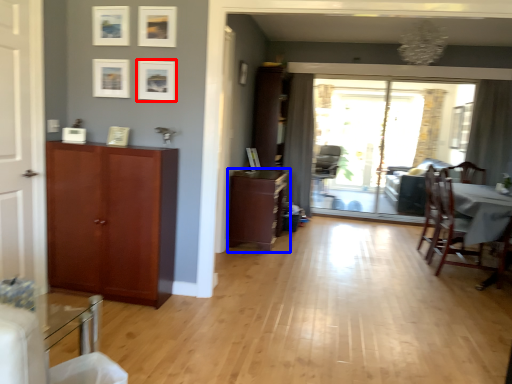
Question: Which object is closer to the camera taking this photo, picture frame (highlighted by a red box) or cabinetry (highlighted by a blue box)?

Choices:
 (A) picture frame
 (B) cabinetry

Answer: (A)